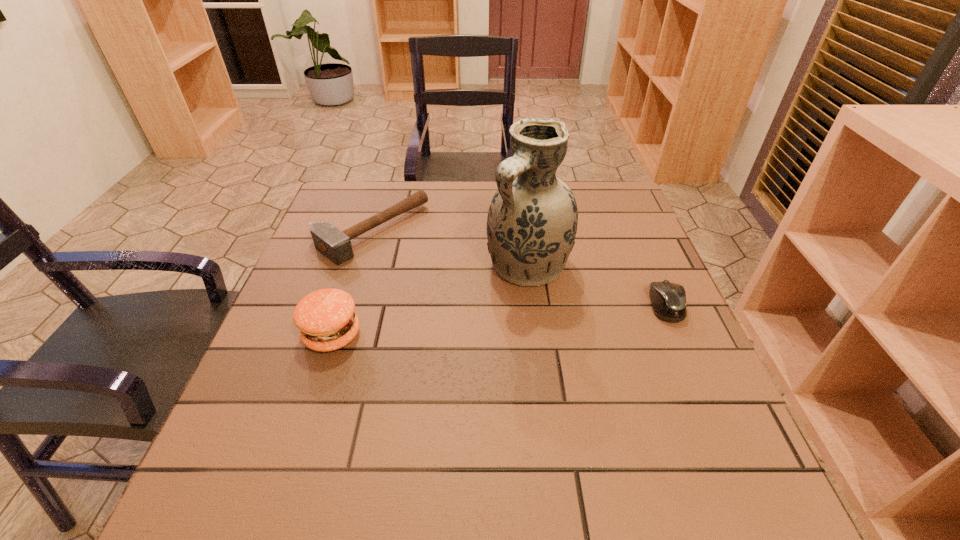
Where is `free space on the desktop that is between the patty and the rightmost object and is positioned with the handle on the side of the tallest object`? The width and height of the screenshot is (960, 540). free space on the desktop that is between the patty and the rightmost object and is positioned with the handle on the side of the tallest object is located at coordinates pos(466,323).

The image size is (960, 540). I want to click on vacant space on the desktop that is between the third shortest object and the rightmost object and is positioned on the striking surface of the hammer, so click(x=503, y=320).